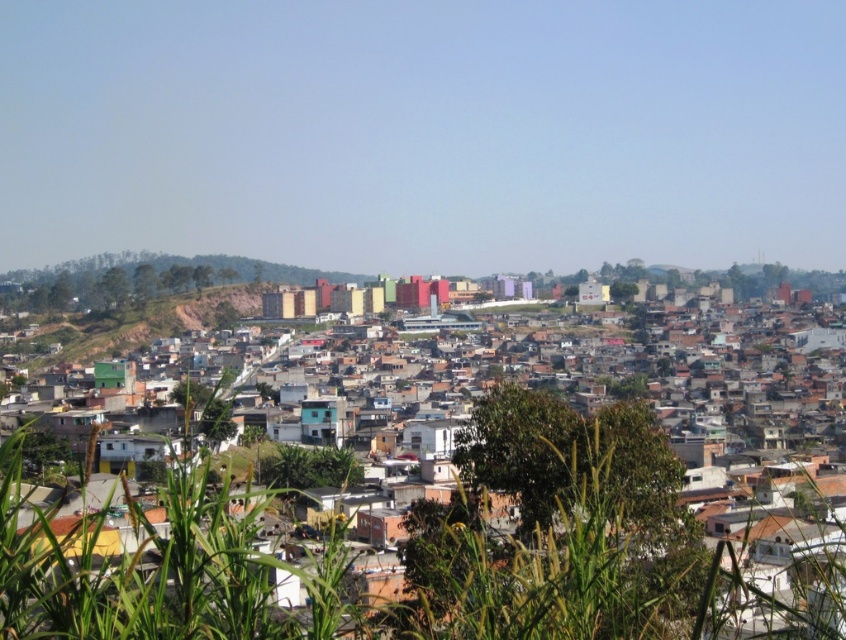
Question: Is multicolored buildings at center below brown dirt at left?

Choices:
 (A) no
 (B) yes

Answer: (B)

Question: Which point appears closest to the camera in this image?

Choices:
 (A) click(81, 349)
 (B) click(354, 476)

Answer: (B)

Question: Which of the following is the closest to the observer?

Choices:
 (A) (700, 348)
 (B) (70, 346)

Answer: (A)

Question: Which object appears closest to the camera in this image?

Choices:
 (A) brown dirt at left
 (B) multicolored buildings at center

Answer: (B)

Question: Can you confirm if multicolored buildings at center is positioned to the right of brown dirt at left?

Choices:
 (A) no
 (B) yes

Answer: (B)

Question: Does multicolored buildings at center appear on the left side of brown dirt at left?

Choices:
 (A) yes
 (B) no

Answer: (B)